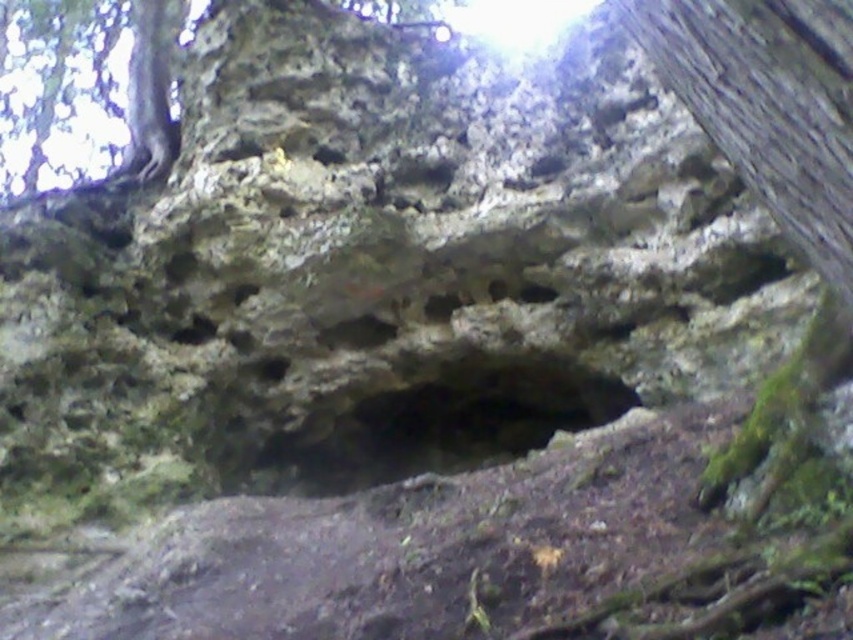
Question: Which object is closer to the camera taking this photo?

Choices:
 (A) smooth bark tree trunk at upper right
 (B) dark rock hole at center
 (C) smooth bark tree trunk at upper left

Answer: (A)

Question: Which of the following is the closest to the observer?

Choices:
 (A) dark rock hole at center
 (B) smooth bark tree trunk at upper right
 (C) smooth bark tree trunk at upper left

Answer: (B)

Question: Can you confirm if smooth bark tree trunk at upper right is smaller than smooth bark tree trunk at upper left?

Choices:
 (A) no
 (B) yes

Answer: (B)

Question: Does smooth bark tree trunk at upper right have a greater width compared to dark rock hole at center?

Choices:
 (A) yes
 (B) no

Answer: (B)

Question: Which object is closer to the camera taking this photo?

Choices:
 (A) smooth bark tree trunk at upper left
 (B) dark rock hole at center

Answer: (B)

Question: Does dark rock hole at center lie in front of smooth bark tree trunk at upper left?

Choices:
 (A) no
 (B) yes

Answer: (B)